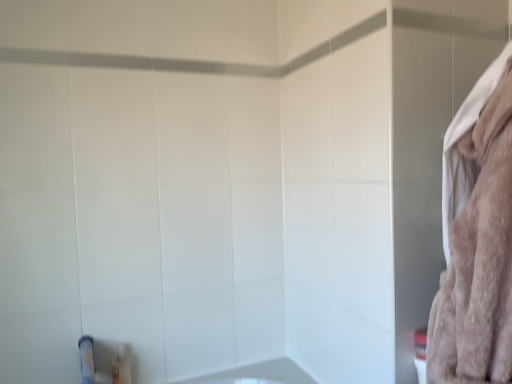
Question: Choose the correct answer: Is translucent plastic tube at lower left inside fluffy pink towel at right or outside it?

Choices:
 (A) outside
 (B) inside

Answer: (A)

Question: From the image's perspective, is translucent plastic tube at lower left above or below fluffy pink towel at right?

Choices:
 (A) above
 (B) below

Answer: (B)

Question: Considering their positions, is translucent plastic tube at lower left located in front of or behind fluffy pink towel at right?

Choices:
 (A) behind
 (B) front

Answer: (A)

Question: Is point coord(442,369) closer or farther from the camera than point coord(119,349)?

Choices:
 (A) farther
 (B) closer

Answer: (B)

Question: In terms of width, does fluffy pink towel at right look wider or thinner when compared to translucent plastic tube at lower left?

Choices:
 (A) wide
 (B) thin

Answer: (A)

Question: From the image's perspective, is fluffy pink towel at right located above or below translucent plastic tube at lower left?

Choices:
 (A) below
 (B) above

Answer: (B)

Question: Considering the positions of fluffy pink towel at right and translucent plastic tube at lower left in the image, is fluffy pink towel at right bigger or smaller than translucent plastic tube at lower left?

Choices:
 (A) small
 (B) big

Answer: (B)